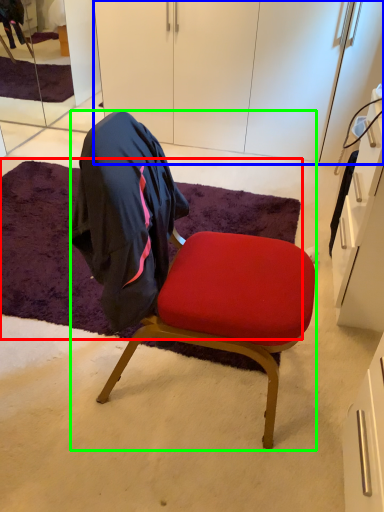
Question: Based on their relative distances, which object is nearer to mat (highlighted by a red box)? Choose from cabinetry (highlighted by a blue box) and chair (highlighted by a green box).

Choices:
 (A) cabinetry
 (B) chair

Answer: (B)